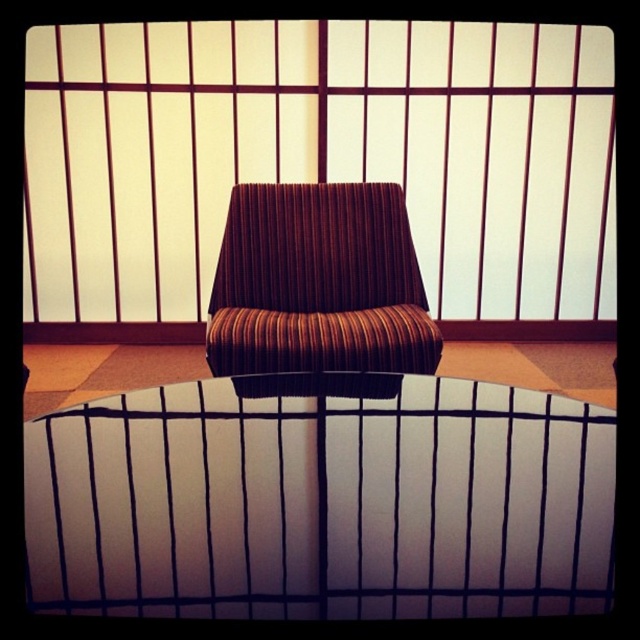
You are arranging a living room and want to place a small side table between the brown striped cushion at center and the brown striped fabric armchair at center. Which object should the table be closer to if you want the table to be closer to the wider object?

The brown striped cushion at center is wider than the brown striped fabric armchair at center. Therefore, the table should be placed closer to the brown striped cushion at center to be near the wider object.